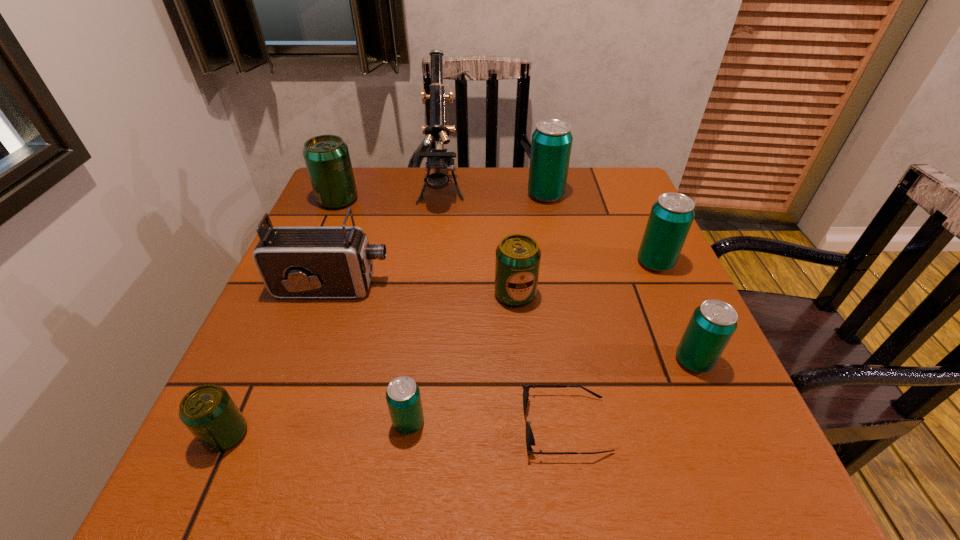
The image size is (960, 540). I want to click on blank region between the second farthest green beer can and the sunglasses, so click(540, 360).

This screenshot has width=960, height=540. In order to click on free spot between the farthest green beer can and the microscope in this screenshot , I will do `click(390, 195)`.

Locate an element on the screen. Image resolution: width=960 pixels, height=540 pixels. free space between the camcorder and the rightmost green beer can is located at coordinates (423, 291).

Locate an element on the screen. blank region between the microscope and the fourth beer can from right to left is located at coordinates (478, 243).

This screenshot has width=960, height=540. What are the coordinates of `vacant space that's between the second smallest teal beer can and the nearest teal beer can` in the screenshot? It's located at (551, 392).

You are a GUI agent. You are given a task and a screenshot of the screen. Output one action in this format:
    pyautogui.click(x=<x>, y=<y>)
    Task: Click on the vacant point located between the microscope and the second farthest teal beer can
    Image resolution: width=960 pixels, height=540 pixels.
    Given the screenshot: What is the action you would take?
    pyautogui.click(x=548, y=227)

At what (x,y) coordinates should I click in order to perform the action: click on vacant point located between the third teal beer can from right to left and the farthest green beer can. Please return your answer as a coordinate pair (x, y). The image size is (960, 540). Looking at the image, I should click on (442, 197).

Choose which object is the nearest neighbor to the biggest green beer can. Please provide its 2D coordinates. Your answer should be formatted as a tuple, i.e. [(x, y)], where the tuple contains the x and y coordinates of a point satisfying the conditions above.

[(437, 158)]

Identify which object is the ninth nearest to the nearest teal beer can. Please provide its 2D coordinates. Your answer should be formatted as a tuple, i.e. [(x, y)], where the tuple contains the x and y coordinates of a point satisfying the conditions above.

[(551, 145)]

This screenshot has height=540, width=960. I want to click on beer can that is the second closest to the second biggest teal beer can, so click(x=551, y=145).